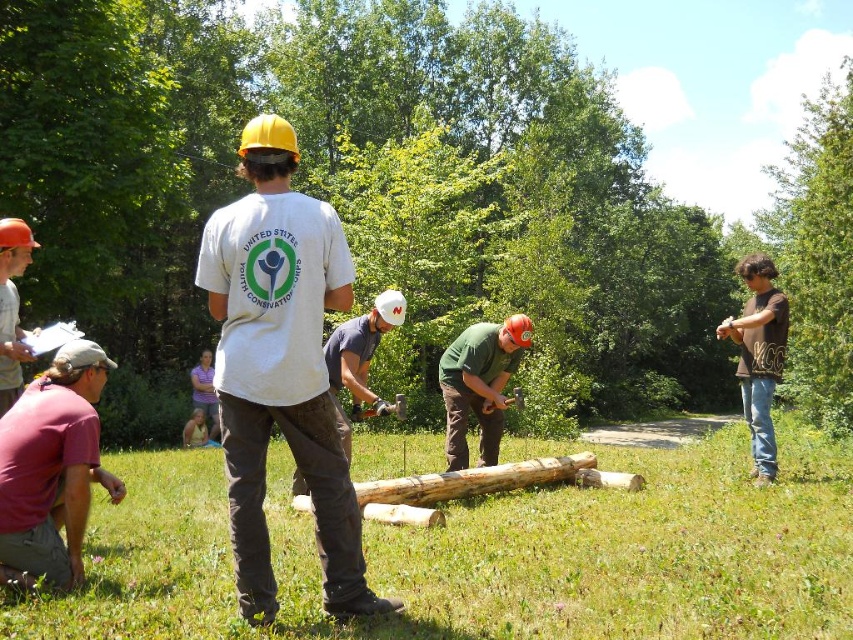
In the scene shown: Who is lower down, green grass at lower center or matte orange hard hat at left?

green grass at lower center is below.

Consider the image. Can you confirm if green grass at lower center is smaller than matte orange hard hat at left?

Incorrect, green grass at lower center is not smaller in size than matte orange hard hat at left.

The image size is (853, 640). Describe the element at coordinates (492, 554) in the screenshot. I see `green grass at lower center` at that location.

Image resolution: width=853 pixels, height=640 pixels. I want to click on green grass at lower center, so click(492, 554).

Who is more forward, (254, 348) or (764, 413)?

Point (254, 348)

Consider the image. How distant is white matte t-shirt at center from brown cotton shirt at right?

white matte t-shirt at center and brown cotton shirt at right are 5.11 meters apart from each other.

Which is in front, point (341, 566) or point (769, 348)?

Point (341, 566) is more forward.

Locate an element on the screen. white matte t-shirt at center is located at coordinates (281, 368).

Consider the image. Who is higher up, green grass at lower center or white matte t-shirt at center?

Positioned higher is white matte t-shirt at center.

Who is shorter, green grass at lower center or white matte t-shirt at center?

With less height is green grass at lower center.

Between point (495, 536) and point (276, 260), which one is positioned behind?

Point (495, 536)

The width and height of the screenshot is (853, 640). In order to click on green grass at lower center in this screenshot , I will do `click(492, 554)`.